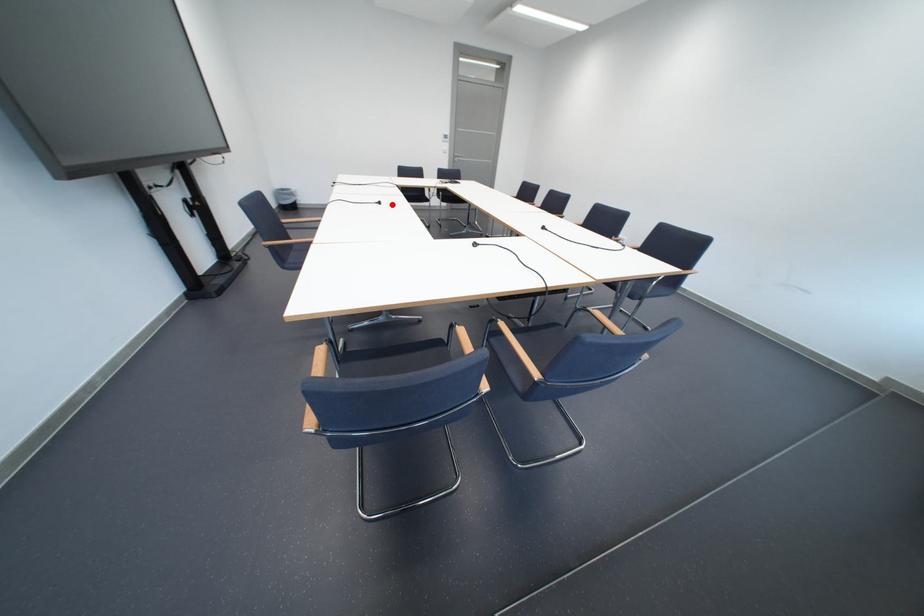
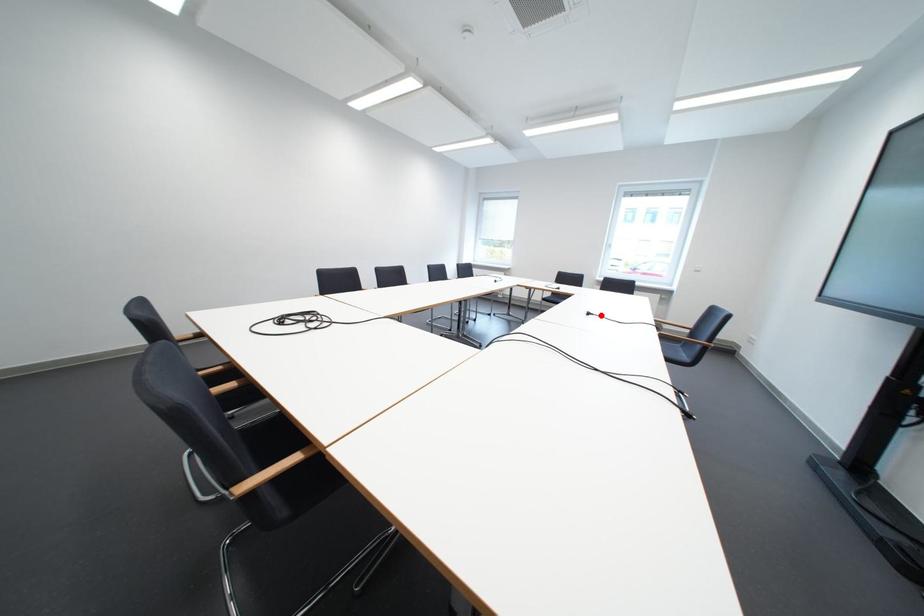
I am providing you with two images of the same scene from different viewpoints. A red point is marked on the first image and another point is marked on the second image. Are the points marked in image1 and image2 representing the same 3D position?

Yes